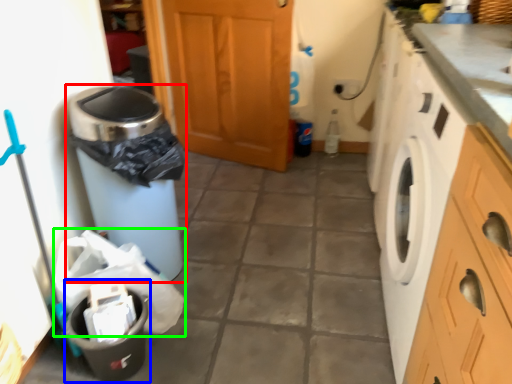
Question: Which is farther away from waste container (highlighted by a red box)? recycling bin (highlighted by a blue box) or material (highlighted by a green box)?

Choices:
 (A) recycling bin
 (B) material

Answer: (A)